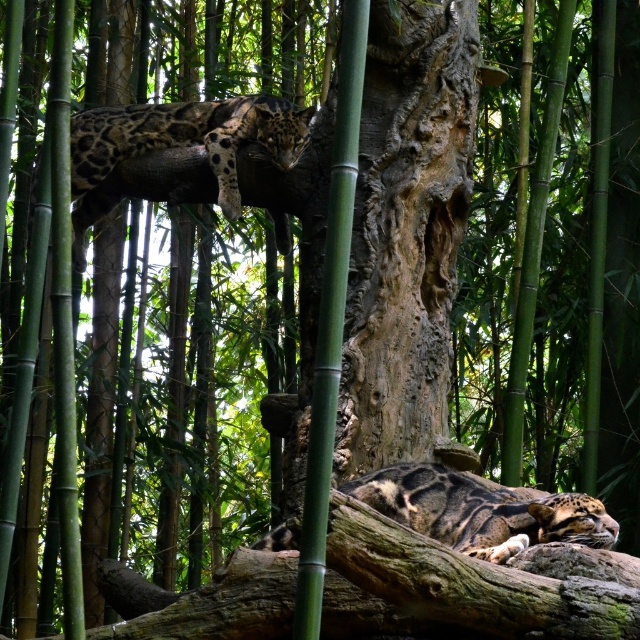
Which of these two, rough bark tree trunk at center or clouded leopard at lower center, stands taller?

With more height is rough bark tree trunk at center.

Does rough bark tree trunk at center appear over clouded leopard at lower center?

Yes.

Measure the distance between rough bark tree trunk at center and camera.

A distance of 21.55 meters exists between rough bark tree trunk at center and camera.

Where is `rough bark tree trunk at center`? rough bark tree trunk at center is located at coordinates (406, 230).

Between rough bark tree trunk at center and clouded leopard at upper left, which one is positioned lower?

rough bark tree trunk at center is below.

Does point (362, 285) lie in front of point (132, 129)?

That is True.

Describe the element at coordinates (406, 230) in the screenshot. I see `rough bark tree trunk at center` at that location.

Locate an element on the screen. Image resolution: width=640 pixels, height=640 pixels. rough bark tree trunk at center is located at coordinates (406, 230).

Does clouded leopard at upper left come behind clouded leopard at lower center?

Yes, it is.

Consider the image. Can you confirm if clouded leopard at upper left is taller than clouded leopard at lower center?

Yes.

Between point (72, 160) and point (477, 486), which one is positioned in front?

Point (477, 486) is in front.

What are the coordinates of `clouded leopard at upper left` in the screenshot? It's located at (177, 147).